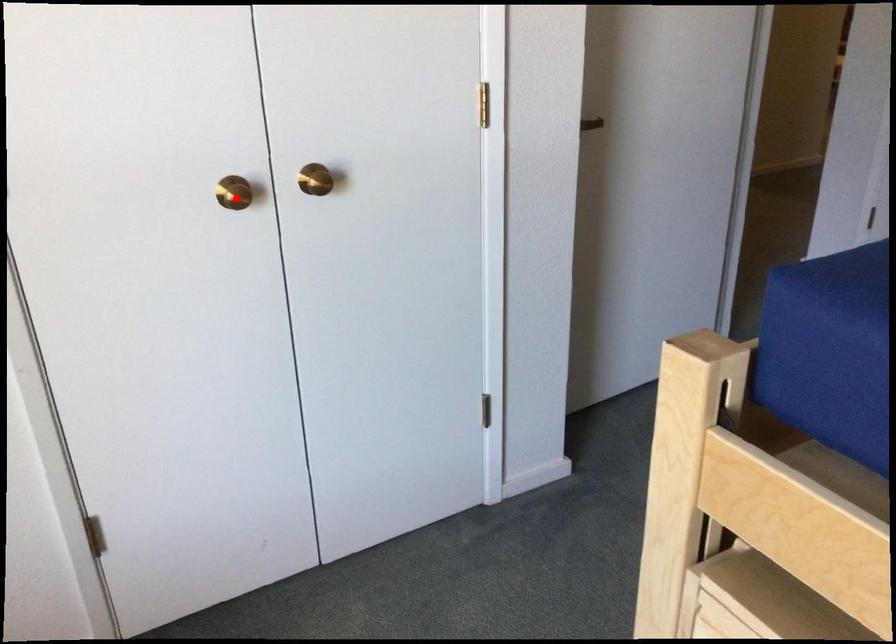
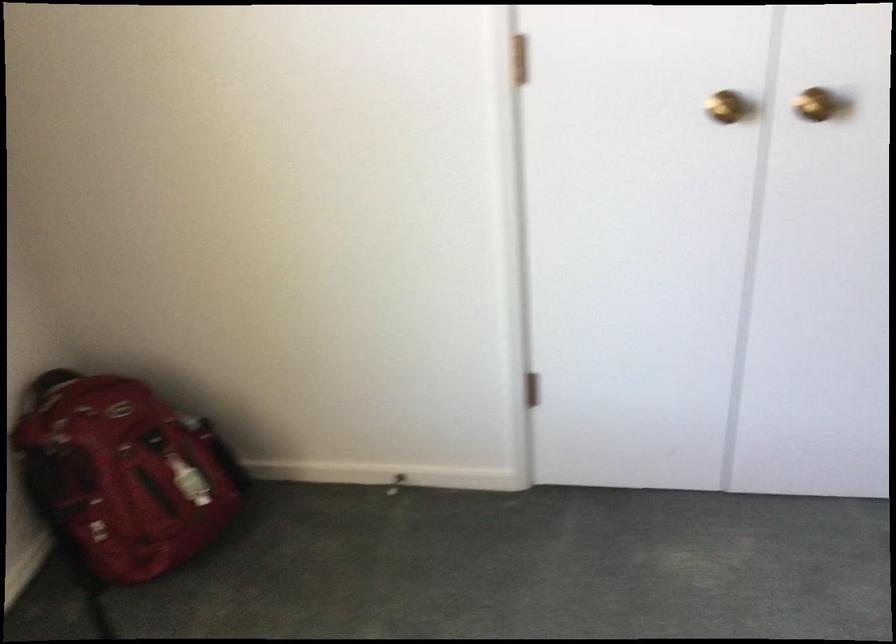
Locate, in the second image, the point that corresponds to the highlighted location in the first image.

(725, 106)